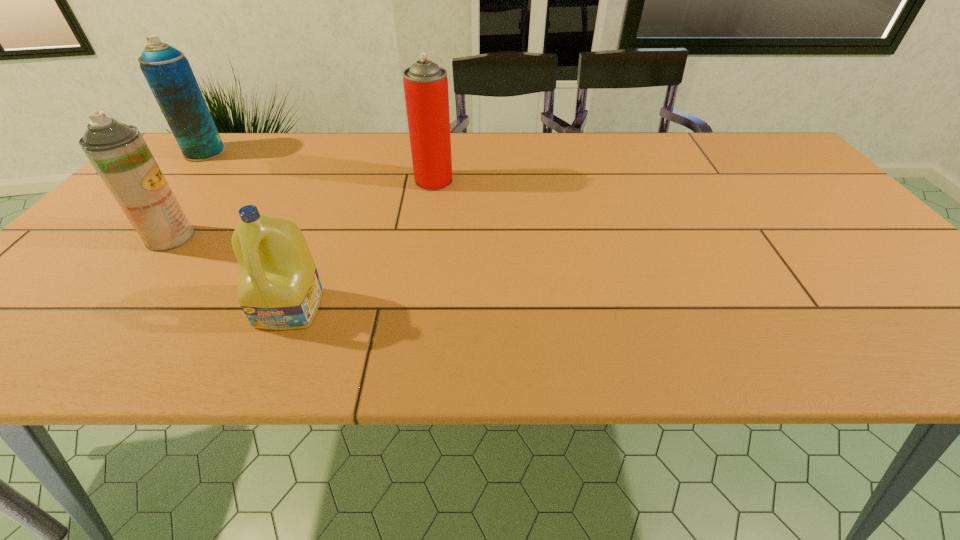
The height and width of the screenshot is (540, 960). In order to click on the rightmost object in this screenshot , I will do click(x=425, y=83).

Locate an element on the screen. The image size is (960, 540). the third nearest object is located at coordinates (425, 83).

Locate an element on the screen. the farthest object is located at coordinates (167, 71).

Where is `the nearest aerosol can`? The width and height of the screenshot is (960, 540). the nearest aerosol can is located at coordinates (118, 152).

Identify the location of the nearest object. The height and width of the screenshot is (540, 960). (279, 288).

Locate an element on the screen. detergent is located at coordinates (279, 288).

Identify the location of vacant space situated on the left of the rightmost aerosol can. The width and height of the screenshot is (960, 540). (377, 181).

You are a GUI agent. You are given a task and a screenshot of the screen. Output one action in this format:
    pyautogui.click(x=<x>, y=<y>)
    Task: Click on the vacant area located 0.250m on the front of the farthest aerosol can
    
    Given the screenshot: What is the action you would take?
    pyautogui.click(x=149, y=214)

I want to click on vacant space located on the back of the nearest aerosol can, so click(x=215, y=181).

Where is `object present at the near edge`? object present at the near edge is located at coordinates (279, 288).